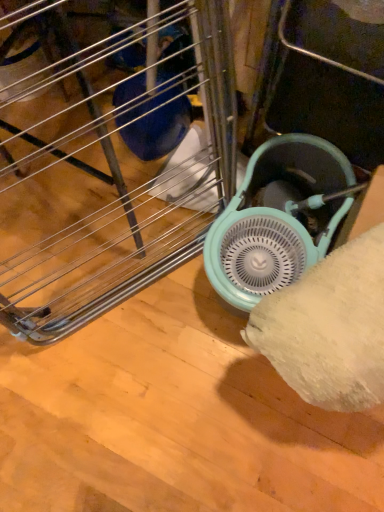
Image resolution: width=384 pixels, height=512 pixels. What do you see at coordinates (278, 218) in the screenshot?
I see `teal plastic mechanical fan at center` at bounding box center [278, 218].

You are a GUI agent. You are given a task and a screenshot of the screen. Output one action in this format:
    pyautogui.click(x=<x>, y=<y>)
    Task: Click on the teal plastic mechanical fan at center
    This screenshot has width=384, height=512.
    Given the screenshot: What is the action you would take?
    278,218

The width and height of the screenshot is (384, 512). In order to click on teal plastic mechanical fan at center in this screenshot , I will do `click(278, 218)`.